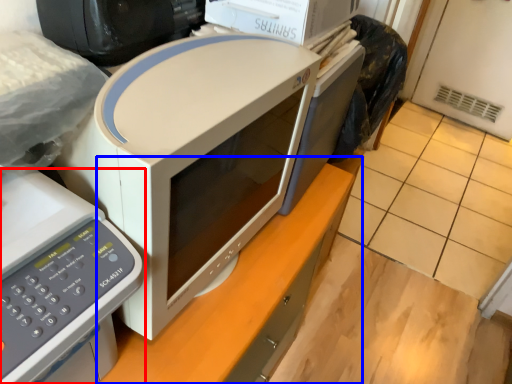
Question: Which object appears closest to the camera in this image, home appliance (highlighted by a red box) or computer desk (highlighted by a blue box)?

Choices:
 (A) home appliance
 (B) computer desk

Answer: (A)